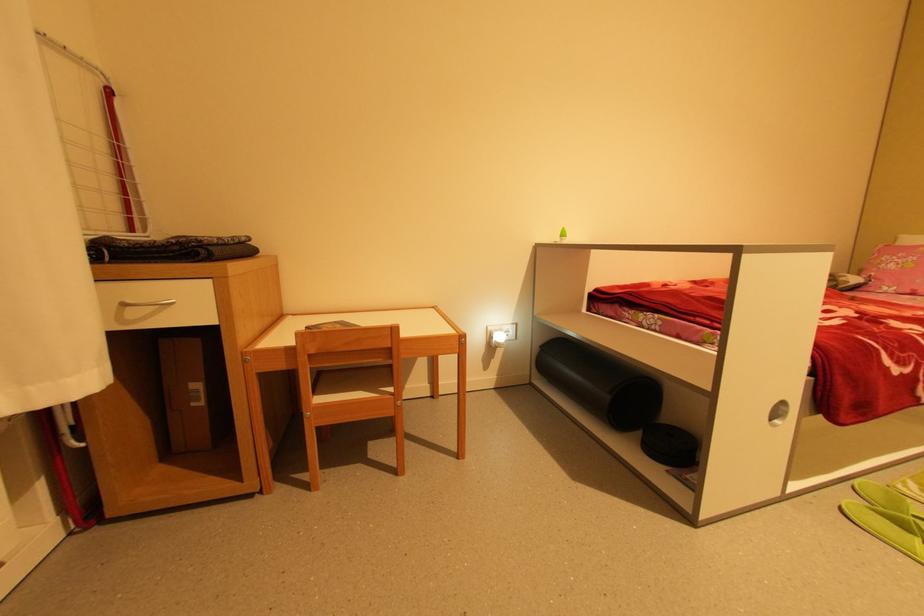
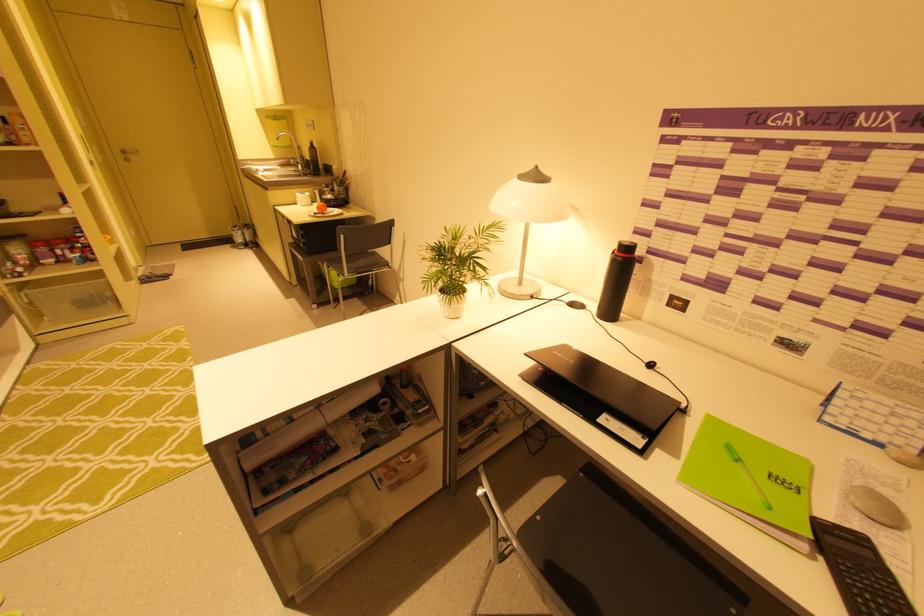
The images are taken continuously from a first-person perspective. In which direction is your viewpoint rotating?

The rotation direction of the camera is right-down.